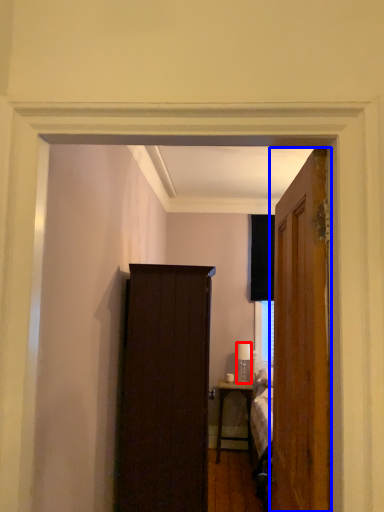
Question: Among these objects, which one is farthest to the camera, lamp (highlighted by a red box) or door (highlighted by a blue box)?

Choices:
 (A) lamp
 (B) door

Answer: (A)